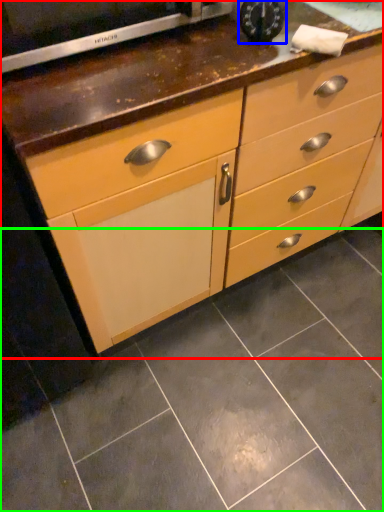
Question: Which object is the farthest from chest of drawers (highlighted by a red box)? Choose among these: appliance (highlighted by a blue box) or ceramic tile (highlighted by a green box).

Choices:
 (A) appliance
 (B) ceramic tile

Answer: (B)